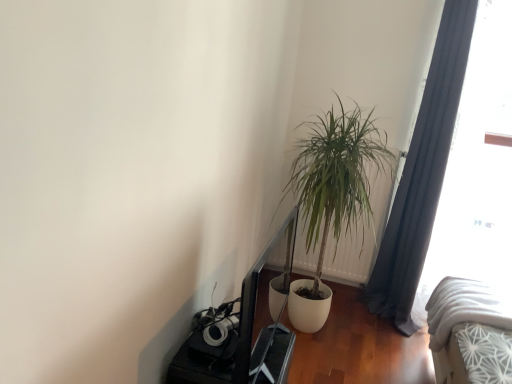
This screenshot has height=384, width=512. What are the coordinates of `free space to the left of dark gray fabric curtain at right` in the screenshot? It's located at (347, 309).